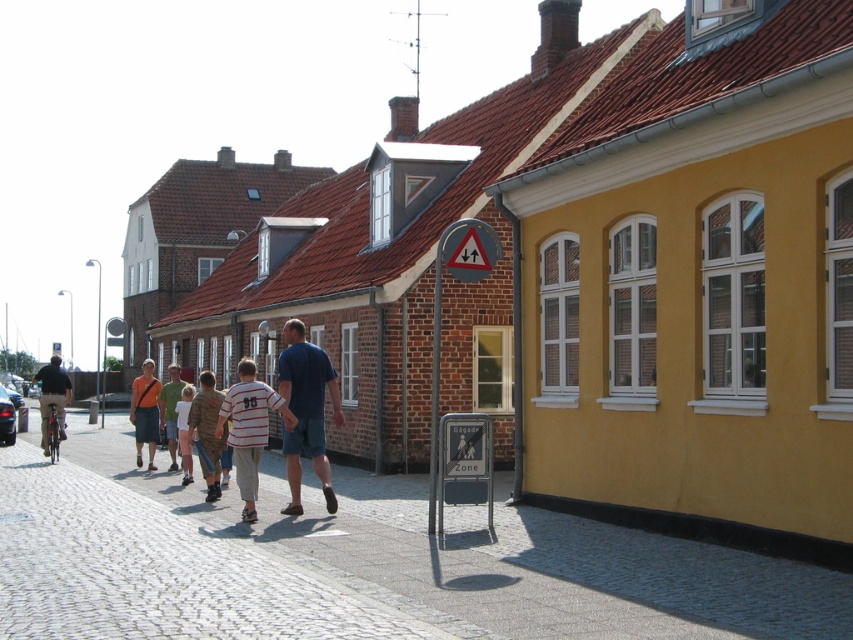
Question: Is blue cotton t-shirt at center wider than white striped shirt at center?

Choices:
 (A) no
 (B) yes

Answer: (A)

Question: Which point is closer to the camera?

Choices:
 (A) (183, 438)
 (B) (163, 394)
 (C) (6, 444)

Answer: (A)

Question: Estimate the real-world distances between objects in this image. Which object is closer to the matte black bicycle at left?

Choices:
 (A) cobblestone pavement at lower left
 (B) metallic reflective yield sign at center

Answer: (A)

Question: Which of the following is the farthest from the observer?

Choices:
 (A) (0, 401)
 (B) (283, 384)
 (C) (166, 403)

Answer: (A)

Question: Is blue cotton t-shirt at center above metallic reflective yield sign at center?

Choices:
 (A) yes
 (B) no

Answer: (B)

Question: Is blue cotton t-shirt at center behind light brown cotton shirt at center?

Choices:
 (A) no
 (B) yes

Answer: (A)